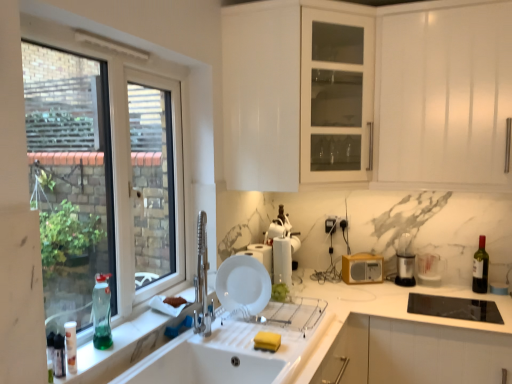
Where is `vacant area on the back side of green glass bottle at window, the 2th bottle viewed from the back`? vacant area on the back side of green glass bottle at window, the 2th bottle viewed from the back is located at coordinates (120, 324).